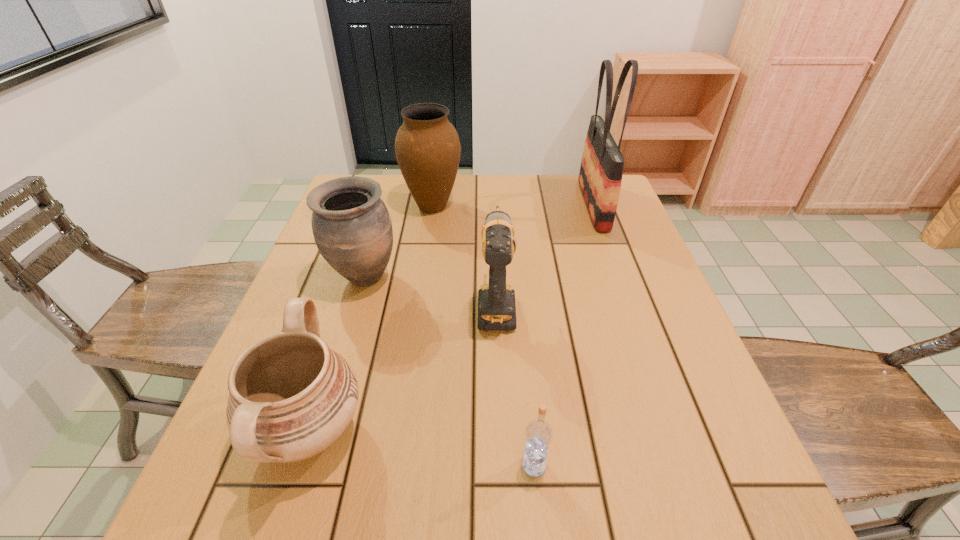
Find the location of `the tallest object`. the tallest object is located at coordinates (601, 170).

Locate an element on the screen. The image size is (960, 540). shopping bag is located at coordinates (601, 170).

Locate an element on the screen. The width and height of the screenshot is (960, 540). the tallest urn is located at coordinates (427, 147).

This screenshot has width=960, height=540. Identify the location of the second tallest object. (427, 147).

The height and width of the screenshot is (540, 960). I want to click on the second nearest urn, so click(352, 228).

I want to click on drill, so click(496, 301).

Where is `the nearest urn`? The image size is (960, 540). the nearest urn is located at coordinates (291, 397).

Identify the location of vodka. (538, 433).

Locate an element on the screen. This screenshot has height=540, width=960. vacant space located on the front-facing side of the rightmost object is located at coordinates (557, 205).

Find the location of a particular element. vacant space located 0.170m on the front-facing side of the rightmost object is located at coordinates (524, 205).